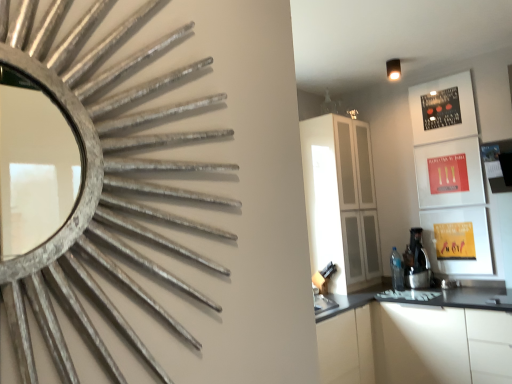
Describe the element at coordinates (416, 262) in the screenshot. I see `satin black coffee machine at right` at that location.

How much space does white glossy cabinet at center, which is the first cabinetry in top-to-bottom order, occupy vertically?

The height of white glossy cabinet at center, which is the first cabinetry in top-to-bottom order, is 1.48 meters.

You are a GUI agent. You are given a task and a screenshot of the screen. Output one action in this format:
    pyautogui.click(x=<x>, y=<y>)
    Task: Click on the silver textured mirror at upper left
    The height and width of the screenshot is (384, 512).
    Given the screenshot: What is the action you would take?
    pyautogui.click(x=102, y=234)

Considering the positions of objects silver textured mirror at upper left and satin black coffee machine at right in the image provided, who is more to the right, silver textured mirror at upper left or satin black coffee machine at right?

satin black coffee machine at right is more to the right.

Considering the sizes of silver textured mirror at upper left and satin black coffee machine at right in the image, is silver textured mirror at upper left wider or thinner than satin black coffee machine at right?

Considering their sizes, silver textured mirror at upper left looks slimmer than satin black coffee machine at right.

Is silver textured mirror at upper left in contact with satin black coffee machine at right?

No, silver textured mirror at upper left is not making contact with satin black coffee machine at right.

Is white glossy cabinet at center, the second cabinetry in the bottom-to-top sequence, not close to satin black coffee machine at right?

That's not correct — white glossy cabinet at center, the second cabinetry in the bottom-to-top sequence, is a little close to satin black coffee machine at right.

From the image's perspective, is white glossy cabinet at center, which is the first cabinetry in top-to-bottom order, above or below satin black coffee machine at right?

Based on their image positions, white glossy cabinet at center, which is the first cabinetry in top-to-bottom order, is located above satin black coffee machine at right.

Who is shorter, white glossy cabinet at center, the second cabinetry in the bottom-to-top sequence, or satin black coffee machine at right?

satin black coffee machine at right.

Is white glossy cabinet at center, which is the first cabinetry in top-to-bottom order, smaller than satin black coffee machine at right?

No, white glossy cabinet at center, which is the first cabinetry in top-to-bottom order, is not smaller than satin black coffee machine at right.

Can you confirm if satin black coffee machine at right is shorter than white glossy cabinet at center, the second cabinetry in the bottom-to-top sequence?

Yes.

Looking at this image, are satin black coffee machine at right and white glossy cabinet at center, the second cabinetry in the bottom-to-top sequence, beside each other?

They are not placed beside each other.

Does point (411, 230) appear closer or farther from the camera than point (357, 225)?

Point (411, 230).

Which of these two, satin black coffee machine at right or white glossy cabinet at center, which is the first cabinetry in top-to-bottom order, is bigger?

white glossy cabinet at center, which is the first cabinetry in top-to-bottom order.

Is white glossy cabinetry at lower right, the second cabinetry from the top, facing towards satin black coffee machine at right?

No, white glossy cabinetry at lower right, the second cabinetry from the top, does not turn towards satin black coffee machine at right.

How many degrees apart are the facing directions of white glossy cabinetry at lower right, the first cabinetry positioned from the bottom, and satin black coffee machine at right?

The angle between the facing direction of white glossy cabinetry at lower right, the first cabinetry positioned from the bottom, and the facing direction of satin black coffee machine at right is 0.75 degrees.

Which is closer to the camera, (467, 324) or (422, 278)?

The point (467, 324) is closer.

Consider the image. From the image's perspective, relative to satin black coffee machine at right, is white glossy cabinetry at lower right, the second cabinetry from the top, above or below?

From the image's perspective, white glossy cabinetry at lower right, the second cabinetry from the top, appears below satin black coffee machine at right.

Which of these two, silver textured mirror at upper left or white glossy cabinet at center, which is the first cabinetry in top-to-bottom order, stands shorter?

Standing shorter between the two is silver textured mirror at upper left.

Is point (89, 280) positioned in front of point (331, 284)?

Yes, point (89, 280) is closer to viewer.

Looking at this image, how different are the orientations of silver textured mirror at upper left and white glossy cabinet at center, which is the first cabinetry in top-to-bottom order, in degrees?

The facing directions of silver textured mirror at upper left and white glossy cabinet at center, which is the first cabinetry in top-to-bottom order, are 1.28 degrees apart.

Based on the photo, how distant is white glossy cabinet at center, which is the first cabinetry in top-to-bottom order, from white glossy cabinetry at lower right, the second cabinetry from the top?

They are 29.32 inches apart.

Does white glossy cabinet at center, which is the first cabinetry in top-to-bottom order, have a lesser width compared to white glossy cabinetry at lower right, the first cabinetry positioned from the bottom?

Yes, white glossy cabinet at center, which is the first cabinetry in top-to-bottom order, is thinner than white glossy cabinetry at lower right, the first cabinetry positioned from the bottom.

From the image's perspective, is white glossy cabinet at center, which is the first cabinetry in top-to-bottom order, on white glossy cabinetry at lower right, the second cabinetry from the top?

Indeed, from the image's perspective, white glossy cabinet at center, which is the first cabinetry in top-to-bottom order, is shown above white glossy cabinetry at lower right, the second cabinetry from the top.

In order to click on cabinetry below the white glossy cabinet at center, which is the first cabinetry in top-to-bottom order (from the image's perspective) in this screenshot , I will do `click(417, 339)`.

Is the depth of white glossy cabinet at center, which is the first cabinetry in top-to-bottom order, greater than that of silver textured mirror at upper left?

Yes, the depth of white glossy cabinet at center, which is the first cabinetry in top-to-bottom order, is greater than that of silver textured mirror at upper left.

How much distance is there between white glossy cabinet at center, the second cabinetry in the bottom-to-top sequence, and silver textured mirror at upper left?

The distance of white glossy cabinet at center, the second cabinetry in the bottom-to-top sequence, from silver textured mirror at upper left is 9.27 feet.

Is white glossy cabinet at center, the second cabinetry in the bottom-to-top sequence, positioned far away from silver textured mirror at upper left?

Yes, white glossy cabinet at center, the second cabinetry in the bottom-to-top sequence, is far from silver textured mirror at upper left.

Where is `mirror that appears in front of the white glossy cabinet at center, which is the first cabinetry in top-to-bottom order`? mirror that appears in front of the white glossy cabinet at center, which is the first cabinetry in top-to-bottom order is located at coordinates point(102,234).

Where is `coffee machine behind the silver textured mirror at upper left`? The image size is (512, 384). coffee machine behind the silver textured mirror at upper left is located at coordinates (416, 262).

You are a GUI agent. You are given a task and a screenshot of the screen. Output one action in this format:
    pyautogui.click(x=<x>, y=<y>)
    Task: Click on the coffee machine below the white glossy cabinet at center, which is the first cabinetry in top-to-bottom order (from the image's perspective)
    Image resolution: width=512 pixels, height=384 pixels.
    Given the screenshot: What is the action you would take?
    pyautogui.click(x=416, y=262)

Considering their positions, is silver textured mirror at upper left positioned closer to white glossy cabinet at center, which is the first cabinetry in top-to-bottom order, than white glossy cabinetry at lower right, the first cabinetry positioned from the bottom?

white glossy cabinetry at lower right, the first cabinetry positioned from the bottom, lies closer to white glossy cabinet at center, which is the first cabinetry in top-to-bottom order, than the other object.

In the scene shown: When comparing their distances from white glossy cabinetry at lower right, the second cabinetry from the top, does silver textured mirror at upper left or satin black coffee machine at right seem closer?

satin black coffee machine at right is closer to white glossy cabinetry at lower right, the second cabinetry from the top.

From the image, which object appears to be nearer to satin black coffee machine at right, white glossy cabinet at center, which is the first cabinetry in top-to-bottom order, or white glossy cabinetry at lower right, the first cabinetry positioned from the bottom?

Among the two, white glossy cabinet at center, which is the first cabinetry in top-to-bottom order, is located nearer to satin black coffee machine at right.

From the picture: Considering their positions, is satin black coffee machine at right positioned closer to silver textured mirror at upper left than white glossy cabinetry at lower right, the second cabinetry from the top?

Among the two, white glossy cabinetry at lower right, the second cabinetry from the top, is located nearer to silver textured mirror at upper left.

From the image, which object appears to be nearer to satin black coffee machine at right, white glossy cabinetry at lower right, the first cabinetry positioned from the bottom, or white glossy cabinet at center, which is the first cabinetry in top-to-bottom order?

Among the two, white glossy cabinet at center, which is the first cabinetry in top-to-bottom order, is located nearer to satin black coffee machine at right.

Looking at the image, which one is located closer to silver textured mirror at upper left, satin black coffee machine at right or white glossy cabinet at center, which is the first cabinetry in top-to-bottom order?

Among the two, white glossy cabinet at center, which is the first cabinetry in top-to-bottom order, is located nearer to silver textured mirror at upper left.

Estimate the real-world distances between objects in this image. Which object is further from white glossy cabinetry at lower right, the second cabinetry from the top, white glossy cabinet at center, which is the first cabinetry in top-to-bottom order, or satin black coffee machine at right?

white glossy cabinet at center, which is the first cabinetry in top-to-bottom order.

Estimate the real-world distances between objects in this image. Which object is further from white glossy cabinet at center, the second cabinetry in the bottom-to-top sequence, white glossy cabinetry at lower right, the first cabinetry positioned from the bottom, or silver textured mirror at upper left?

Among the two, silver textured mirror at upper left is located further to white glossy cabinet at center, the second cabinetry in the bottom-to-top sequence.

Where is `cabinetry positioned between silver textured mirror at upper left and white glossy cabinet at center, which is the first cabinetry in top-to-bottom order, from near to far`? The image size is (512, 384). cabinetry positioned between silver textured mirror at upper left and white glossy cabinet at center, which is the first cabinetry in top-to-bottom order, from near to far is located at coordinates (417, 339).

The image size is (512, 384). I want to click on coffee machine between silver textured mirror at upper left and white glossy cabinet at center, the second cabinetry in the bottom-to-top sequence, along the z-axis, so click(x=416, y=262).

The image size is (512, 384). I want to click on coffee machine between white glossy cabinet at center, the second cabinetry in the bottom-to-top sequence, and white glossy cabinetry at lower right, the second cabinetry from the top, in the up-down direction, so click(x=416, y=262).

In order to click on cabinetry positioned between silver textured mirror at upper left and satin black coffee machine at right from near to far in this screenshot , I will do `click(417, 339)`.